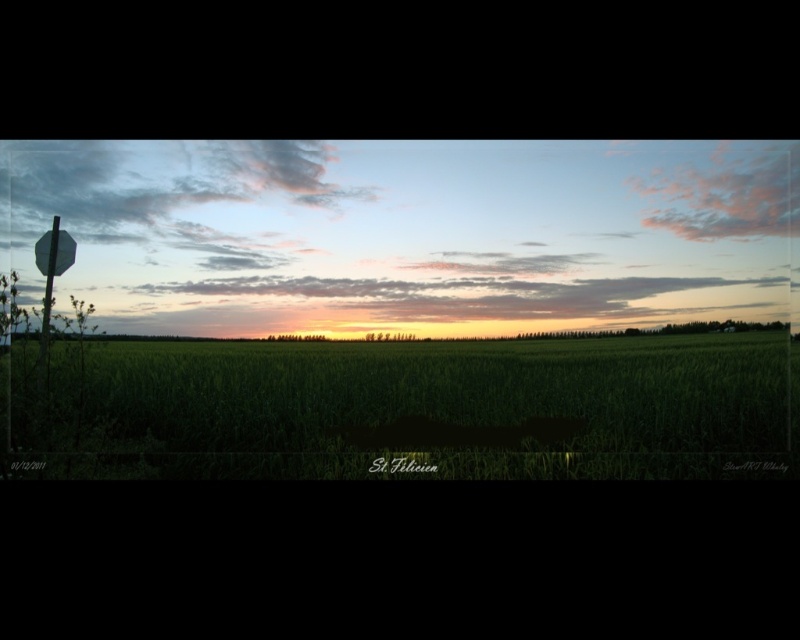
You are standing in the middle of the field looking towards the horizon. There are two points marked in the image, one at coordinate point(x=570, y=381) and another at point(x=62, y=243). Which point is closer to you?

Point(x=62, y=243) is closer to you because it is less further to the camera than point(x=570, y=381).

You are a farmer who needs to place a new metallic stop sign at left in your field. The green grass at center is currently occupying the space. Can you tell me if the area where the stop sign will be placed is smaller or larger than the stop sign itself?

The green grass at center is bigger than the metallic stop sign at left, so the area where the stop sign will be placed is larger than the stop sign itself.

You are driving a car and see the green grass at center and the metallic stop sign at left ahead on the road. Which object will you reach first?

The green grass at center is closer to the viewer than the metallic stop sign at left, so you will reach the green grass at center first.